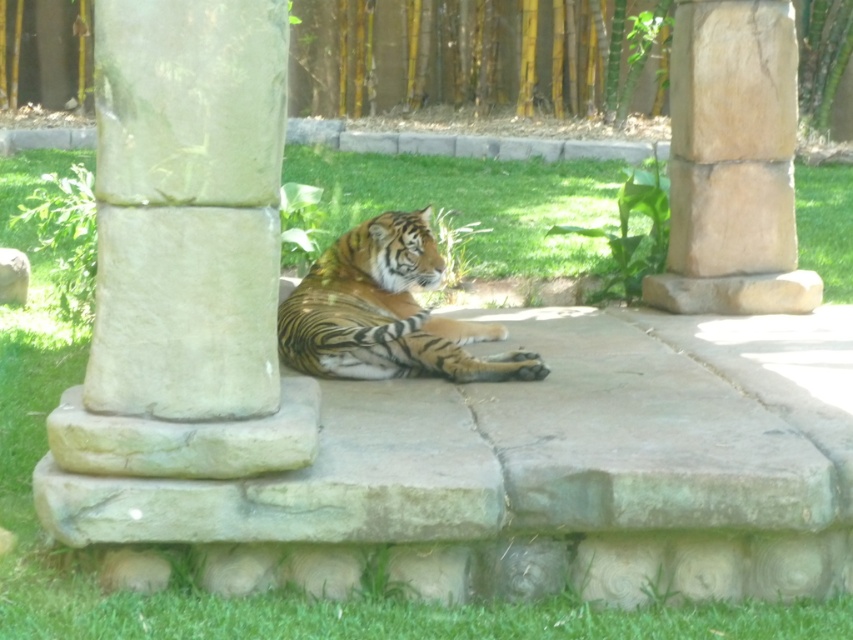
Based on the photo, you are standing in front of the tiger resting on the stone platform. There are two pillars in the scene, a smooth stone pillar at center and a natural stone pillar at center. Which pillar is closer to you?

The smooth stone pillar at center is closer to you because it is in front of the natural stone pillar at center.

You are standing in front of the tiger resting on the stone platform. You notice two points marked in the scene. The first point is at coordinate point (175, 300) and the second is at point (646, 301). Which point is closer to you?

Point (175, 300) is closer to you than point (646, 301).